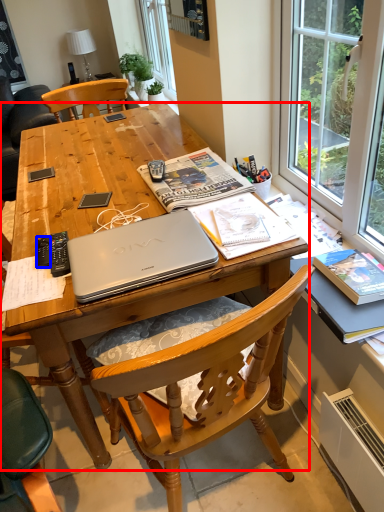
Question: Which object is closer to the camera taking this photo, desk (highlighted by a red box) or remote control (highlighted by a blue box)?

Choices:
 (A) desk
 (B) remote control

Answer: (A)